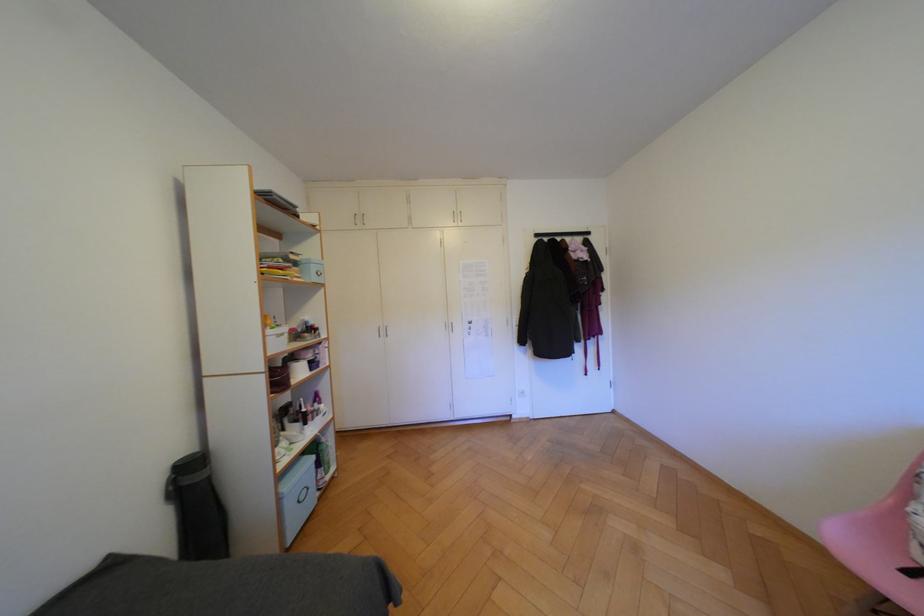
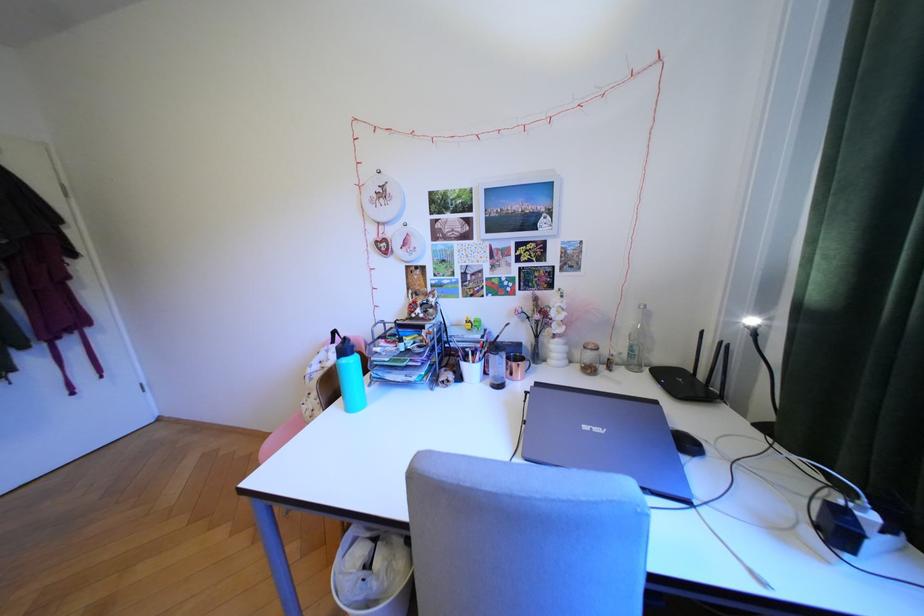
Question: The camera is either moving clockwise (left) or counter-clockwise (right) around the object. The first image is from the beginning of the video and the second image is from the end. Is the camera moving left or right when shooting the video?

Choices:
 (A) Left
 (B) Right

Answer: (A)